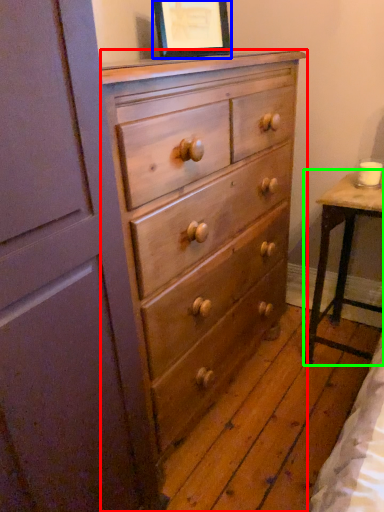
Question: Based on their relative distances, which object is nearer to chest of drawers (highlighted by a red box)? Choose from picture frame (highlighted by a blue box) and table (highlighted by a green box).

Choices:
 (A) picture frame
 (B) table

Answer: (B)